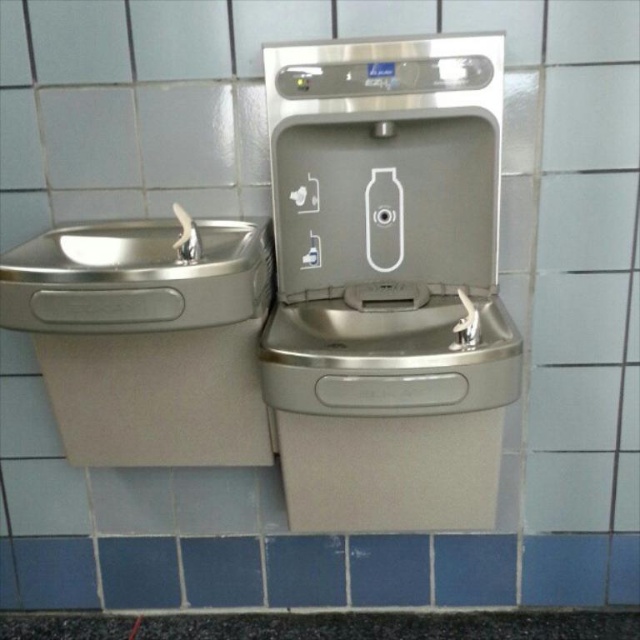
You are a maintenance worker checking the facilities. You need to clean both the brushed metal sink at left and the blue tile at center. Which one requires more cleaning supplies because of its size?

The brushed metal sink at left is larger in size than blue tile at center, so it requires more cleaning supplies.

You are a maintenance worker inspecting two fixtures in a restroom. You notice the satin nickel faucet at upper center and the brushed metal sink at left. Which fixture is positioned to the right of the other?

The satin nickel faucet at upper center is positioned to the right of the brushed metal sink at left.